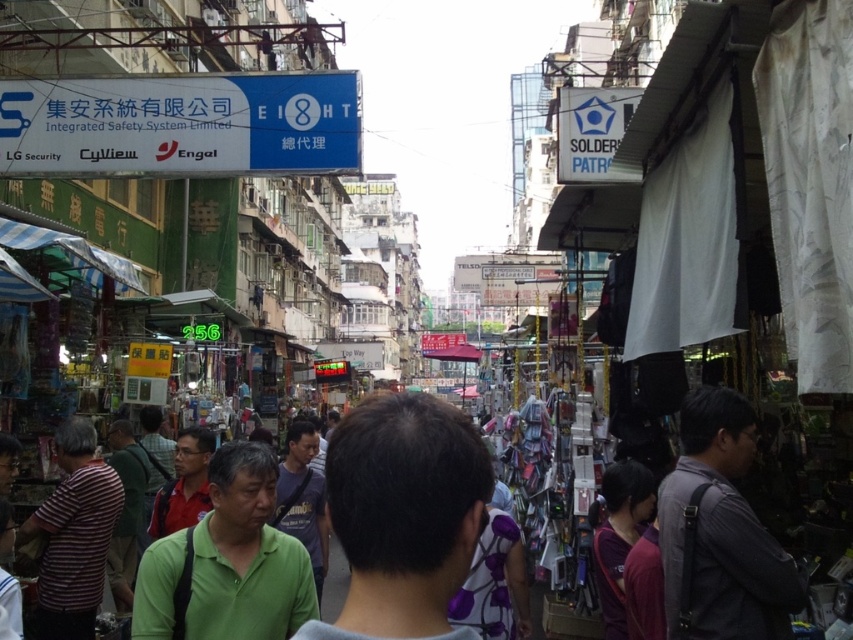
You are a customer standing at the entrance of the market. You see a dark gray shirt at center and a green textured shirt at center displayed in the stalls. If you want to buy both shirts, which one should you approach first to minimize the distance you walk?

You should approach the dark gray shirt at center first because it is closer to the entrance than the green textured shirt at center. Since the dark gray shirt at center is only 21.67 meters away from the green textured shirt at center, moving to the closer one first would reduce the total walking distance.

You are a customer at the market and want to buy both the dark gray shirt at center and the striped fabric shirt at lower left. However, you notice that the shirts are displayed on different mannequins. Which shirt is closer to you as you stand in front of the stalls?

The dark gray shirt at center is closer to you because it is in front of the striped fabric shirt at lower left.

You are a customer at the market and want to buy both the dark gray shirt at center and the striped fabric shirt at lower left. Which shirt is located to the right of the other?

The dark gray shirt at center is positioned on the right side of striped fabric shirt at lower left.